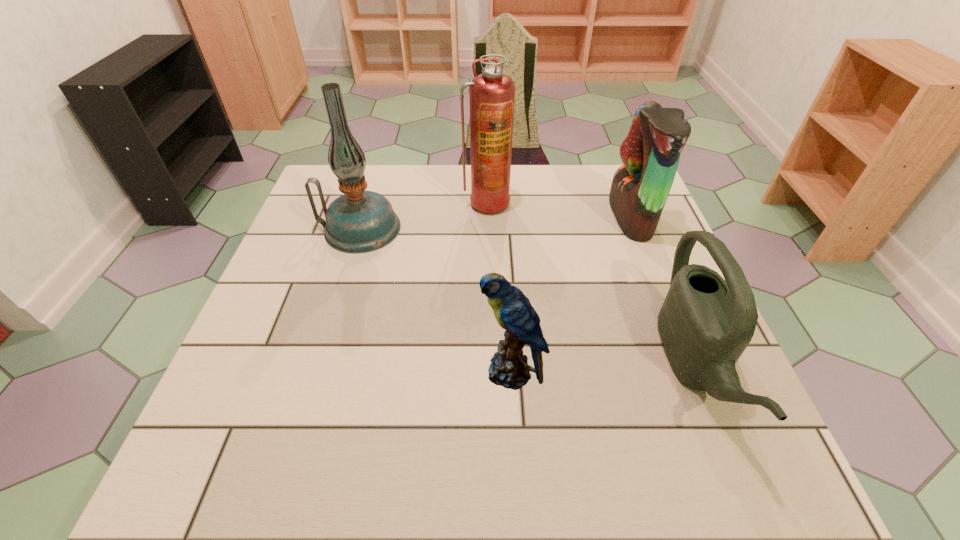
At what (x,y) coordinates should I click in order to perform the action: click on fire extinguisher. Please return your answer as a coordinate pair (x, y). Looking at the image, I should click on (x=492, y=94).

I want to click on the leftmost object, so click(x=359, y=221).

Image resolution: width=960 pixels, height=540 pixels. What are the coordinates of `the farther parrot` in the screenshot? It's located at (650, 153).

Identify the location of the right parrot. This screenshot has width=960, height=540. (650, 153).

This screenshot has width=960, height=540. In order to click on the left parrot in this screenshot , I will do `click(509, 368)`.

The height and width of the screenshot is (540, 960). I want to click on the nearer parrot, so tap(509, 368).

Locate an element on the screen. watering can is located at coordinates (705, 323).

Where is `free region located 0.210m on the side of the fire extinguisher with the label`? The height and width of the screenshot is (540, 960). free region located 0.210m on the side of the fire extinguisher with the label is located at coordinates (488, 271).

Locate an element on the screen. This screenshot has height=540, width=960. vacant space situated on the back of the leftmost object is located at coordinates (371, 194).

Locate an element on the screen. This screenshot has width=960, height=540. blank space located 0.190m at the face of the taller parrot is located at coordinates (540, 217).